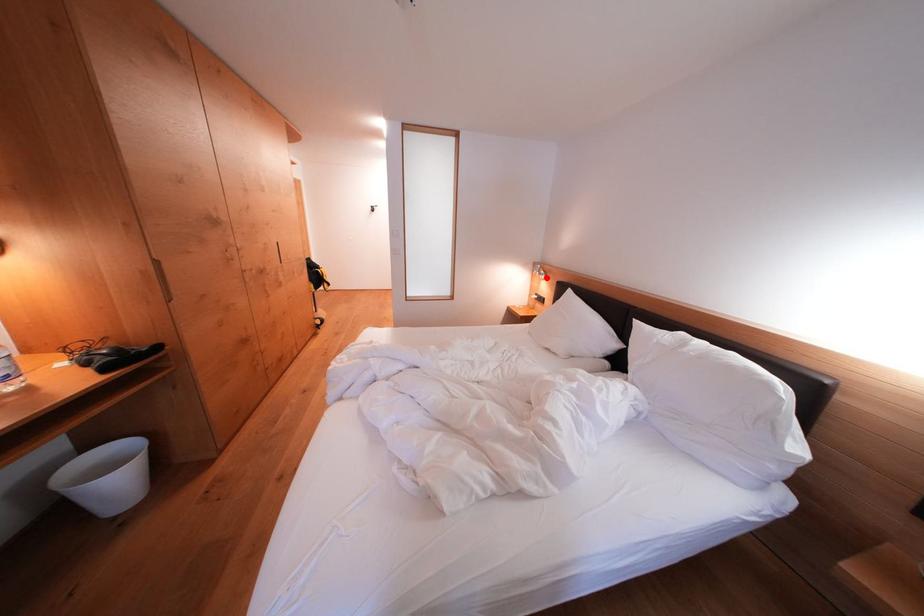
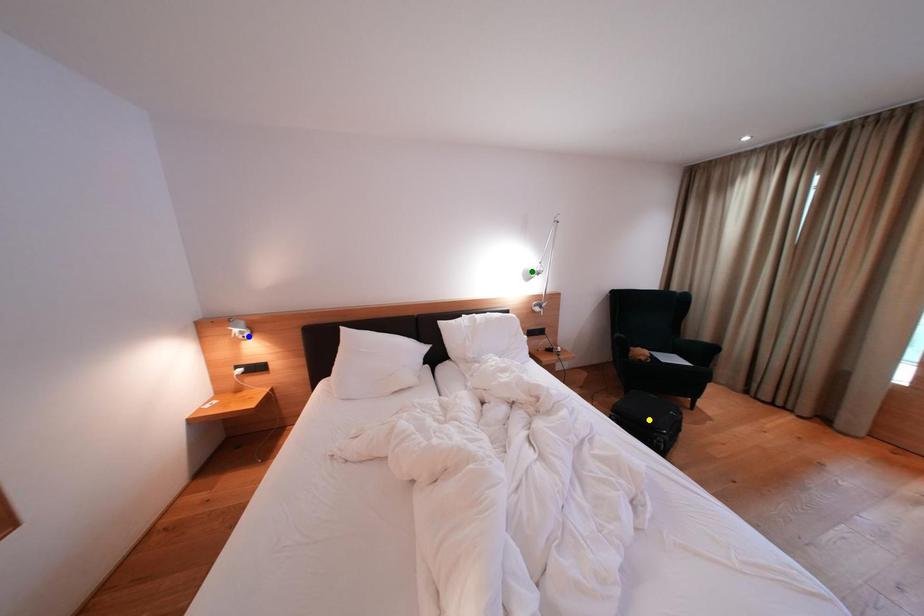
Question: I am providing you with two images of the same scene from different viewpoints. A red point is marked on the first image. You are given multiple points on the second image. Which point in image 2 is actually the same real-world point as the red point in image 1?

Choices:
 (A) green point
 (B) yellow point
 (C) blue point

Answer: (C)